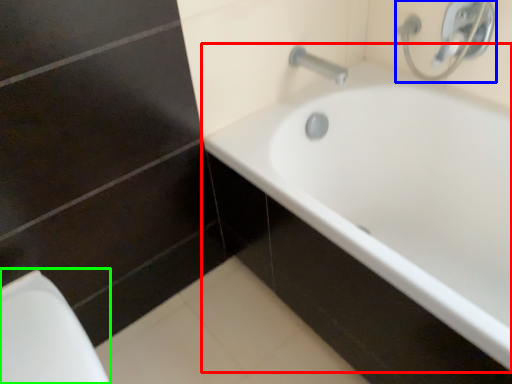
Question: Based on their relative distances, which object is farther from bathtub (highlighted by a red box)? Choose from plumbing fixture (highlighted by a blue box) and porcelain (highlighted by a green box).

Choices:
 (A) plumbing fixture
 (B) porcelain

Answer: (B)